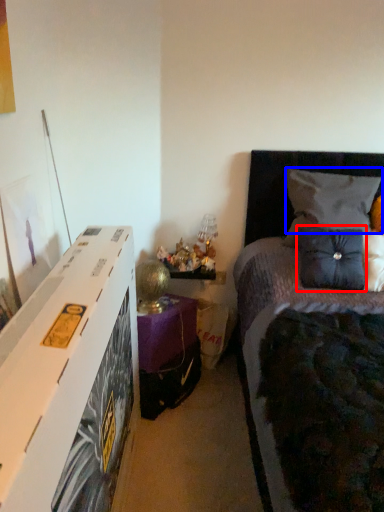
Question: Which point is further to the camera, pillow (highlighted by a red box) or pillow (highlighted by a blue box)?

Choices:
 (A) pillow
 (B) pillow

Answer: (B)